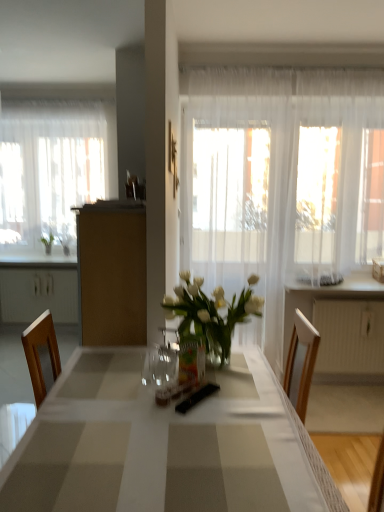
The height and width of the screenshot is (512, 384). Describe the element at coordinates (53, 169) in the screenshot. I see `sheer white curtain at left, which ranks as the second curtain in front-to-back order` at that location.

Measure the distance between white glossy table at center and camera.

white glossy table at center is 3.41 feet from camera.

Measure the distance between white plastic radiator at right and camera.

The distance of white plastic radiator at right from camera is 3.31 meters.

Where is `sheer white curtain at center, positioned as the 1th curtain in front-to-back order`? This screenshot has width=384, height=512. sheer white curtain at center, positioned as the 1th curtain in front-to-back order is located at coordinates (280, 181).

You are a GUI agent. You are given a task and a screenshot of the screen. Output one action in this format:
    pyautogui.click(x=<x>, y=<y>)
    Task: Click on the brown matte cabinet at center
    Image resolution: width=384 pixels, height=512 pixels.
    Given the screenshot: What is the action you would take?
    pyautogui.click(x=112, y=273)

Which is behind, point (91, 315) or point (370, 274)?

The point (370, 274) is more distant.

In the scene shown: From the image's perspective, is brown matte cabinet at center located above or below white glossy countertop at right?

From the image's perspective, brown matte cabinet at center appears below white glossy countertop at right.

Between brown matte cabinet at center and white glossy countertop at right, which one has more height?

With more height is brown matte cabinet at center.

From a real-world perspective, is brown matte cabinet at center located higher than white glossy countertop at right?

Correct, in the physical world, brown matte cabinet at center is higher than white glossy countertop at right.

Which is correct: white glossy countertop at right is inside white plastic radiator at right, or outside of it?

white glossy countertop at right is located beyond the bounds of white plastic radiator at right.

In the image, is white glossy countertop at right on the left side or the right side of white plastic radiator at right?

Based on their positions, white glossy countertop at right is located to the left of white plastic radiator at right.

Locate an element on the screen. This screenshot has width=384, height=512. radiator located on the right of white glossy countertop at right is located at coordinates (349, 336).

Could you tell me if sheer white curtain at left, positioned as the 1th curtain in back-to-front order, is turned towards white glossy table at center?

Yes, sheer white curtain at left, positioned as the 1th curtain in back-to-front order, faces towards white glossy table at center.

From the image's perspective, is sheer white curtain at left, positioned as the 1th curtain in back-to-front order, located above white glossy table at center?

Yes, from the image's perspective, sheer white curtain at left, positioned as the 1th curtain in back-to-front order, is over white glossy table at center.

Looking at this image, between sheer white curtain at left, positioned as the 1th curtain in back-to-front order, and white glossy table at center, which one has larger width?

With larger width is white glossy table at center.

The image size is (384, 512). There is a white glossy table at center. In order to click on the 2nd curtain above it (from the image's perspective) in this screenshot , I will do `click(53, 169)`.

Is sheer white curtain at left, the 2th curtain viewed from the right, shorter than sheer white curtain at center, the 2th curtain positioned from the left?

Yes.

Based on the photo, which object is further away from the camera taking this photo, sheer white curtain at left, positioned as the 1th curtain in back-to-front order, or sheer white curtain at center, which is the first curtain in right-to-left order?

sheer white curtain at left, positioned as the 1th curtain in back-to-front order.

From a real-world perspective, is sheer white curtain at left, positioned as the 1th curtain in back-to-front order, below sheer white curtain at center, the 2th curtain positioned from the left?

No, from a real-world perspective, sheer white curtain at left, positioned as the 1th curtain in back-to-front order, is not beneath sheer white curtain at center, the 2th curtain positioned from the left.

Which of these two, sheer white curtain at center, positioned as the 1th curtain in front-to-back order, or white glossy countertop at right, is wider?

With larger width is white glossy countertop at right.

Is sheer white curtain at center, the 2th curtain positioned from the left, further to the viewer compared to white glossy countertop at right?

No, it is in front of white glossy countertop at right.

From a real-world perspective, who is located higher, sheer white curtain at center, the 2th curtain positioned from the left, or white glossy countertop at right?

sheer white curtain at center, the 2th curtain positioned from the left, is physically above.

Is white plastic radiator at right completely or partially outside of white glossy countertop at right?

That's correct, white plastic radiator at right is outside of white glossy countertop at right.

From the image's perspective, is white plastic radiator at right located above or below white glossy countertop at right?

→ white plastic radiator at right is below white glossy countertop at right.

Considering the sizes of objects white plastic radiator at right and white glossy countertop at right in the image provided, who is bigger, white plastic radiator at right or white glossy countertop at right?

Bigger between the two is white plastic radiator at right.

Which is less distant, (347, 348) or (359, 274)?

Point (347, 348) appears to be farther away from the viewer than point (359, 274).

Is white glossy countertop at right outside of sheer white curtain at center, marked as the 2th curtain in a back-to-front arrangement?

Indeed, white glossy countertop at right is completely outside sheer white curtain at center, marked as the 2th curtain in a back-to-front arrangement.

Is white glossy countertop at right positioned far away from sheer white curtain at center, positioned as the 1th curtain in front-to-back order?

No, white glossy countertop at right is not far from sheer white curtain at center, positioned as the 1th curtain in front-to-back order.

From a real-world perspective, is white glossy countertop at right physically located above or below sheer white curtain at center, positioned as the 1th curtain in front-to-back order?

Clearly, from a real-world perspective, white glossy countertop at right is below sheer white curtain at center, positioned as the 1th curtain in front-to-back order.

This screenshot has width=384, height=512. Identify the location of counter top above the brown matte cabinet at center (from the image's perspective). (342, 287).

The width and height of the screenshot is (384, 512). What are the coordinates of `counter top in front of the white plastic radiator at right` in the screenshot? It's located at (342, 287).

Which object lies nearer to the anchor point white glossy countertop at right, brown matte cabinet at center or white glossy table at center?

brown matte cabinet at center is positioned closer to the anchor white glossy countertop at right.

Which object lies nearer to the anchor point white glossy countertop at right, brown matte cabinet at center or sheer white curtain at center, the 2th curtain positioned from the left?

sheer white curtain at center, the 2th curtain positioned from the left, is closer to white glossy countertop at right.

Looking at the image, which one is located closer to white plastic radiator at right, white glossy countertop at right or brown matte cabinet at center?

white glossy countertop at right.

Estimate the real-world distances between objects in this image. Which object is closer to sheer white curtain at center, which is the first curtain in right-to-left order, white glossy countertop at right or sheer white curtain at left, the 1th curtain when ordered from left to right?

white glossy countertop at right lies closer to sheer white curtain at center, which is the first curtain in right-to-left order, than the other object.

Based on the photo, which object lies further to the anchor point sheer white curtain at left, the 1th curtain when ordered from left to right, white plastic radiator at right or sheer white curtain at center, the 2th curtain positioned from the left?

white plastic radiator at right lies further to sheer white curtain at left, the 1th curtain when ordered from left to right, than the other object.

Looking at the image, which one is located closer to white glossy countertop at right, brown matte cabinet at center or sheer white curtain at left, the 1th curtain when ordered from left to right?

brown matte cabinet at center is positioned closer to the anchor white glossy countertop at right.

Based on their spatial positions, is sheer white curtain at center, positioned as the 1th curtain in front-to-back order, or brown matte cabinet at center further from sheer white curtain at left, positioned as the 1th curtain in back-to-front order?

brown matte cabinet at center lies further to sheer white curtain at left, positioned as the 1th curtain in back-to-front order, than the other object.

Looking at the image, which one is located further to sheer white curtain at left, positioned as the 1th curtain in back-to-front order, white plastic radiator at right or white glossy table at center?

white glossy table at center is positioned further to the anchor sheer white curtain at left, positioned as the 1th curtain in back-to-front order.

Find the location of a particular element. cabinetry between white glossy table at center and sheer white curtain at center, which is the first curtain in right-to-left order, from front to back is located at coordinates (112, 273).

I want to click on curtain between white glossy table at center and white glossy countertop at right in the front-back direction, so click(280, 181).

The image size is (384, 512). In order to click on curtain between white glossy table at center and white plastic radiator at right in the front-back direction in this screenshot , I will do `click(280, 181)`.

This screenshot has width=384, height=512. In order to click on counter top positioned between white glossy table at center and sheer white curtain at left, the 2th curtain viewed from the right, from near to far in this screenshot , I will do `click(342, 287)`.